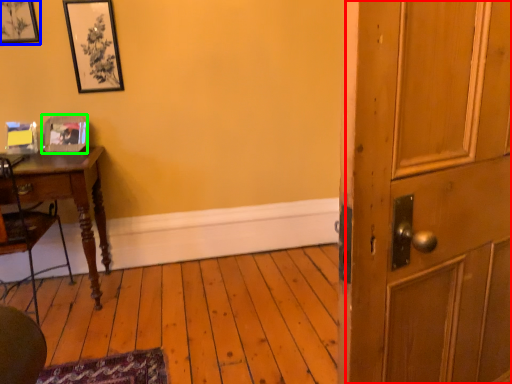
Question: Which is farther away from barn door (highlighted by a red box)? picture frame (highlighted by a blue box) or picture frame (highlighted by a green box)?

Choices:
 (A) picture frame
 (B) picture frame

Answer: (A)